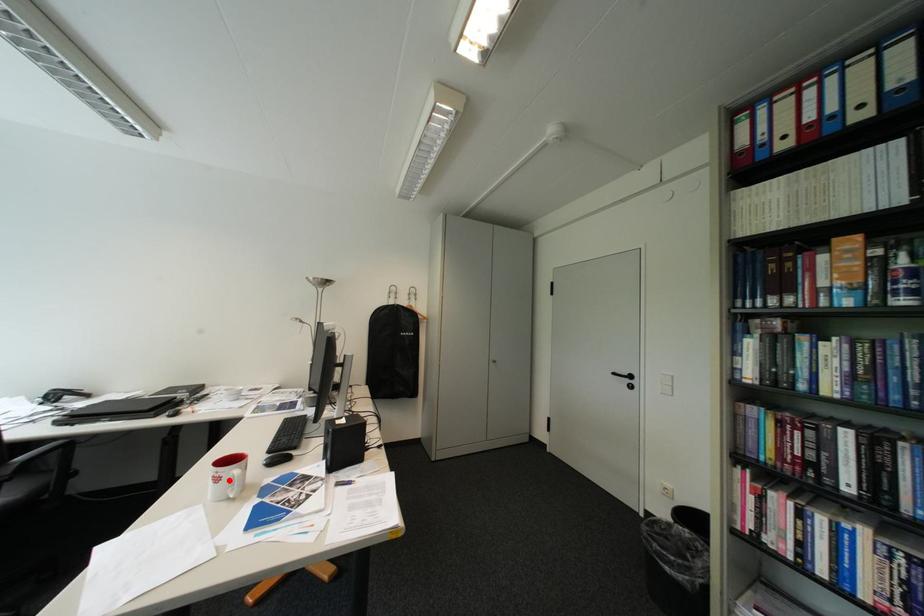
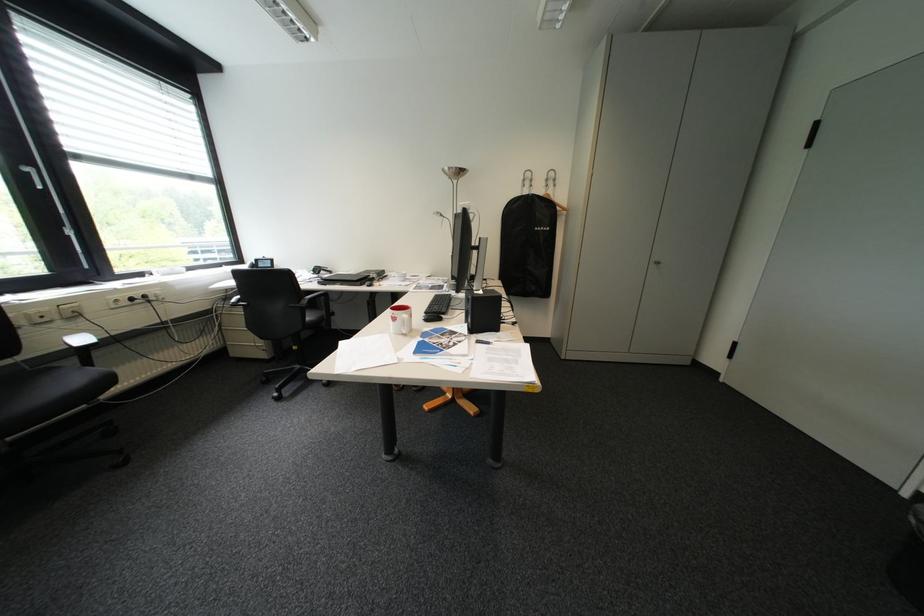
The point at the highlighted location is marked in the first image. Where is the corresponding point in the second image?

(407, 320)